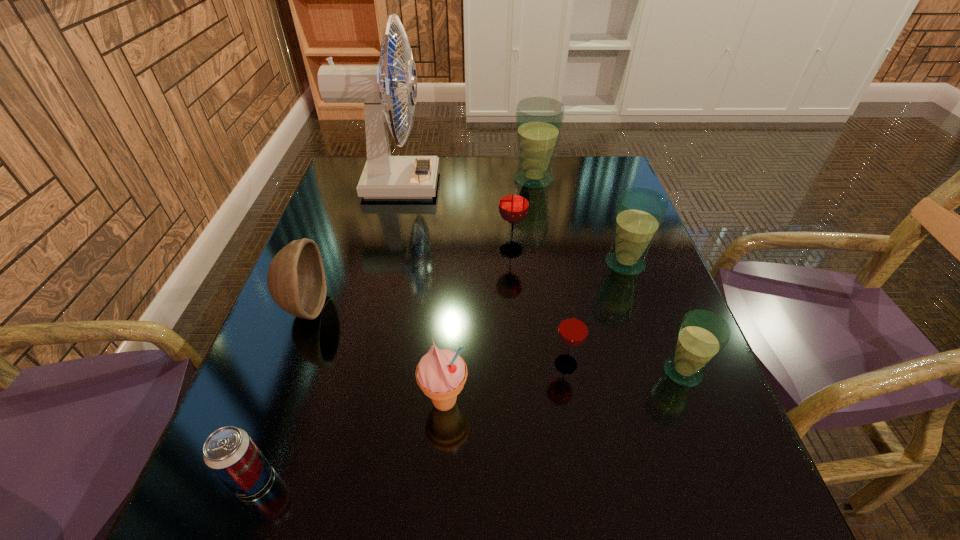
This screenshot has height=540, width=960. Identify the location of free space located 0.090m on the front of the nearest blue glass. (708, 437).

Locate an element on the screen. This screenshot has height=540, width=960. blank space located 0.050m on the right of the smaller red glass is located at coordinates tap(606, 364).

Find the location of a particular element. Image resolution: width=960 pixels, height=540 pixels. vacant space located on the back of the nearest object is located at coordinates (311, 319).

The width and height of the screenshot is (960, 540). I want to click on fan situated at the far edge, so click(x=384, y=176).

At what (x,y) coordinates should I click in order to perform the action: click on glass that is positioned at the far edge. Please return your answer as a coordinate pair (x, y). The image size is (960, 540). Looking at the image, I should click on (539, 120).

This screenshot has height=540, width=960. I want to click on object that is positioned at the near edge, so click(x=229, y=452).

This screenshot has width=960, height=540. Find the location of `fan at the left edge`. fan at the left edge is located at coordinates (384, 176).

In order to click on bowl present at the left edge in this screenshot , I will do `click(296, 281)`.

Where is `beer can that is positioned at the left edge`? This screenshot has width=960, height=540. beer can that is positioned at the left edge is located at coordinates (229, 452).

Find the location of a particular element. Image resolution: width=960 pixels, height=540 pixels. object at the far left corner is located at coordinates 384,176.